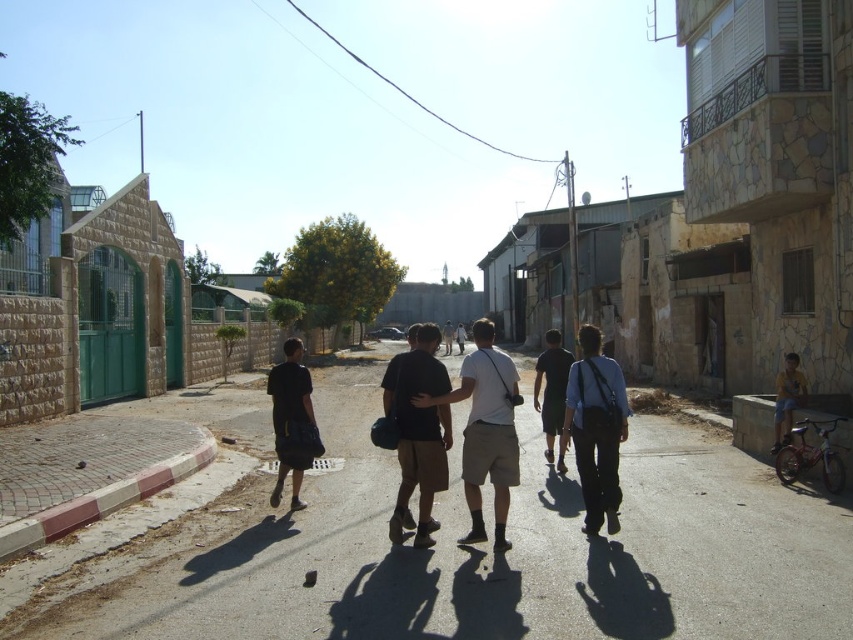
Question: Does black matte shorts at center appear over dark gray fabric pants at center?

Choices:
 (A) yes
 (B) no

Answer: (B)

Question: Which object is farther from the camera taking this photo?

Choices:
 (A) dark brown leather backpack at center
 (B) dark blue jeans at center
 (C) dark gray cotton t-shirt at center
 (D) smooth concrete alley at center

Answer: (B)

Question: Which object appears farthest from the camera in this image?

Choices:
 (A) yellow fabric shirt at lower right
 (B) dark gray fabric pants at center
 (C) dark gray cotton t-shirt at center
 (D) dark brown leather backpack at center

Answer: (B)

Question: Is dark brown leather backpack at center to the left of dark gray fabric pants at center from the viewer's perspective?

Choices:
 (A) yes
 (B) no

Answer: (A)

Question: Is dark gray cotton t-shirt at center bigger than yellow fabric shirt at lower right?

Choices:
 (A) yes
 (B) no

Answer: (A)

Question: Which is farther from the yellow fabric shirt at lower right?

Choices:
 (A) smooth concrete alley at center
 (B) dark gray cotton t-shirt at center
 (C) dark blue jeans at center
 (D) dark brown leather backpack at center

Answer: (D)